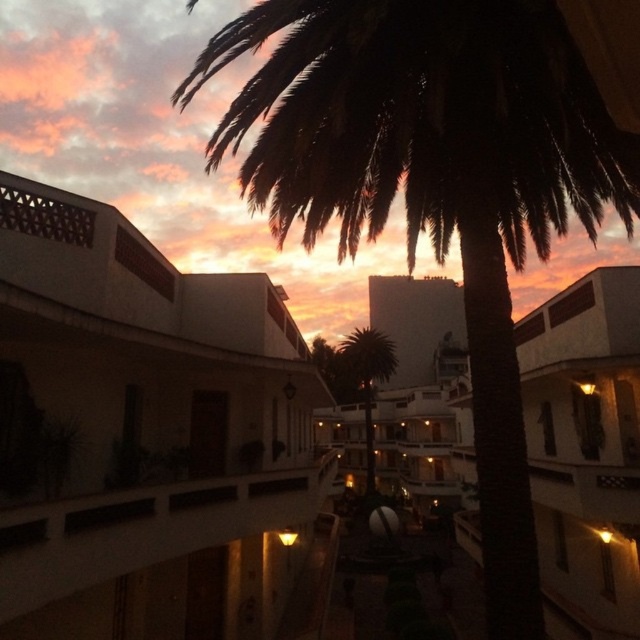
Question: In this image, where is white matte building at upper left located relative to dark green leafy palm tree at upper center?

Choices:
 (A) above
 (B) below

Answer: (B)

Question: Considering the real-world distances, which object is farthest from the green leafy palm tree at center?

Choices:
 (A) dark green leafy palm tree at upper center
 (B) white matte building at upper left

Answer: (A)

Question: Does white matte building at upper left appear on the left side of green leafy palm tree at center?

Choices:
 (A) yes
 (B) no

Answer: (A)

Question: Is white matte building at upper left behind green leafy palm tree at center?

Choices:
 (A) yes
 (B) no

Answer: (B)

Question: Which point is closer to the camera taking this photo?

Choices:
 (A) (173, 508)
 (B) (348, 371)

Answer: (A)

Question: Which point is closer to the camera taking this photo?

Choices:
 (A) (352, 349)
 (B) (253, 49)

Answer: (B)